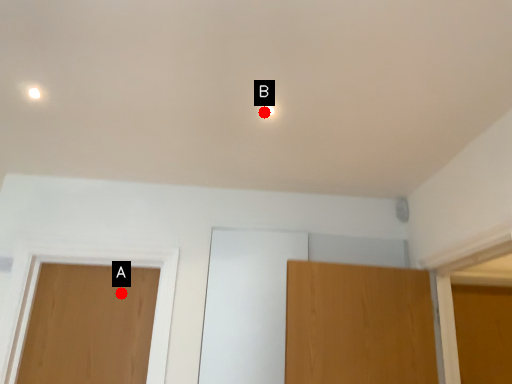
Question: Two points are circled on the image, labeled by A and B beside each circle. Which point is closer to the camera?

Choices:
 (A) A is closer
 (B) B is closer

Answer: (B)